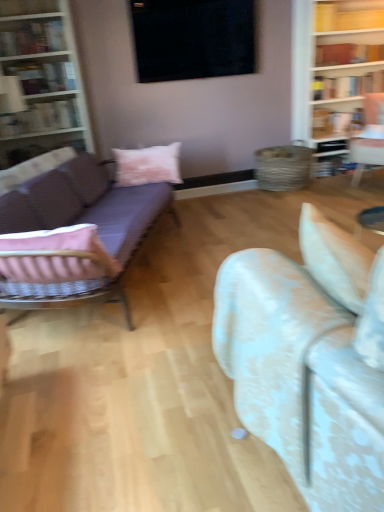
This screenshot has height=512, width=384. I want to click on vacant area on top of matte black bookshelf at upper left, the fourth book positioned from the back (from a real-world perspective), so click(x=25, y=24).